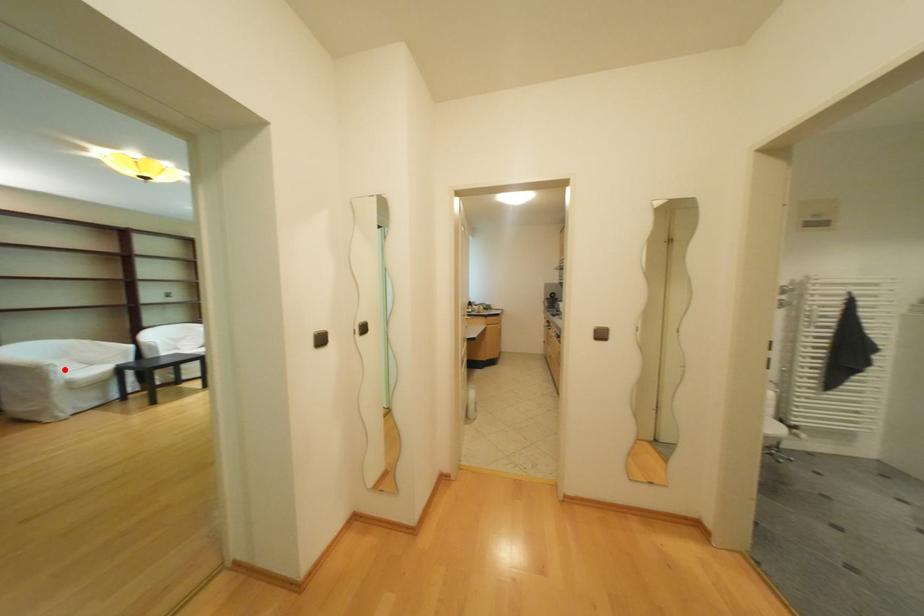
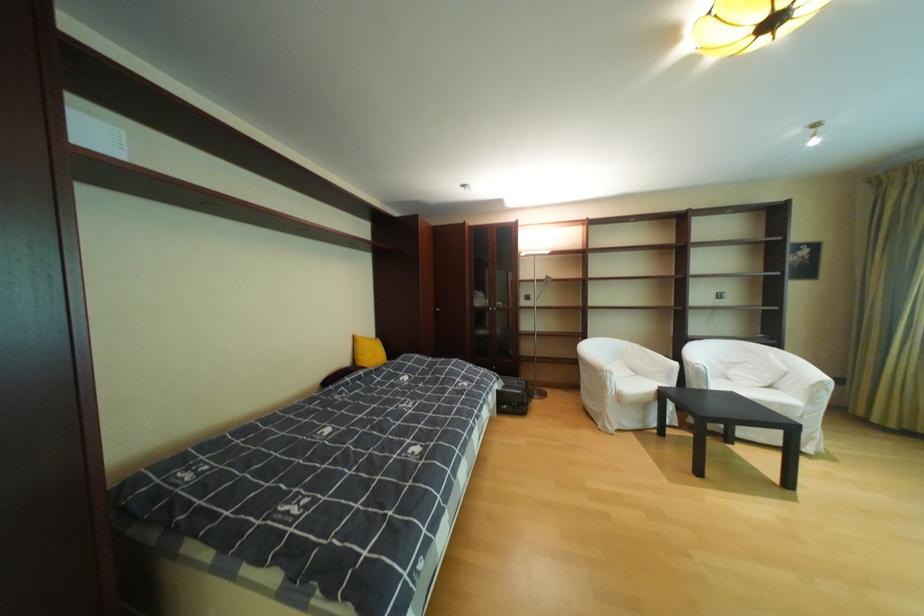
In the second image, find the point that corresponds to the highlighted location in the first image.

(621, 377)